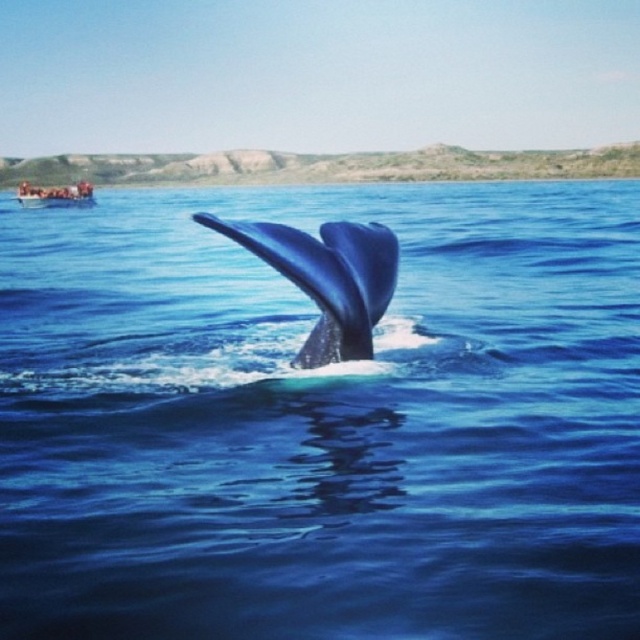
Is blue smooth water at center in front of shiny blue whale at center?

Yes, it is.

The image size is (640, 640). What do you see at coordinates (321, 420) in the screenshot? I see `blue smooth water at center` at bounding box center [321, 420].

Where is `blue smooth water at center`? The image size is (640, 640). blue smooth water at center is located at coordinates (321, 420).

Is blue smooth water at center positioned at the back of wooden boat at upper left?

That is False.

Measure the distance between blue smooth water at center and wooden boat at upper left.

blue smooth water at center is 36.92 feet away from wooden boat at upper left.

Does point (284, 592) come in front of point (90, 196)?

Yes, it is in front of point (90, 196).

Identify the location of blue smooth water at center. This screenshot has width=640, height=640. (321, 420).

Does shiny blue whale at center come in front of wooden boat at upper left?

Yes.

The width and height of the screenshot is (640, 640). What are the coordinates of `shiny blue whale at center` in the screenshot? It's located at (326, 278).

The image size is (640, 640). What are the coordinates of `shiny blue whale at center` in the screenshot? It's located at [326, 278].

Find the location of a particular element. This screenshot has width=640, height=640. shiny blue whale at center is located at coordinates point(326,278).